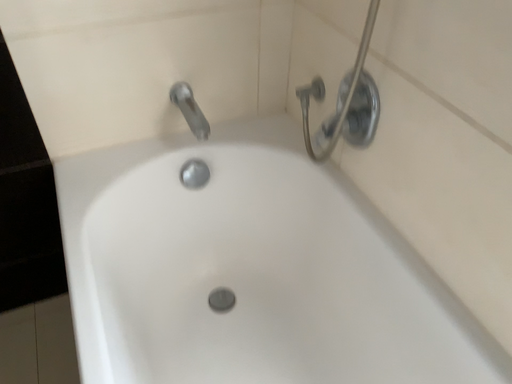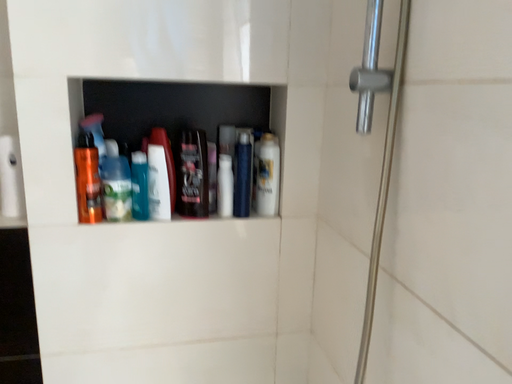
Question: Which way did the camera rotate in the video?

Choices:
 (A) rotated downward
 (B) rotated upward

Answer: (B)